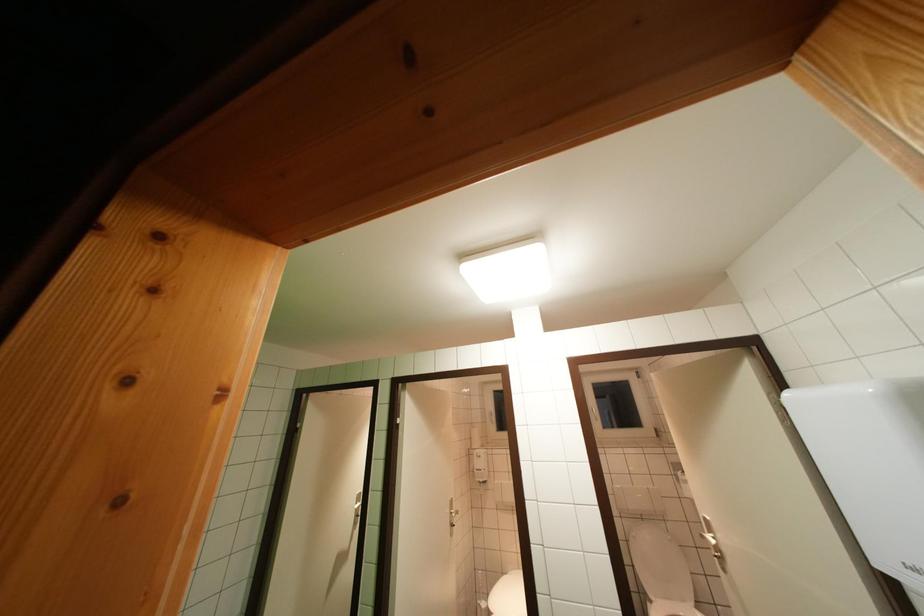
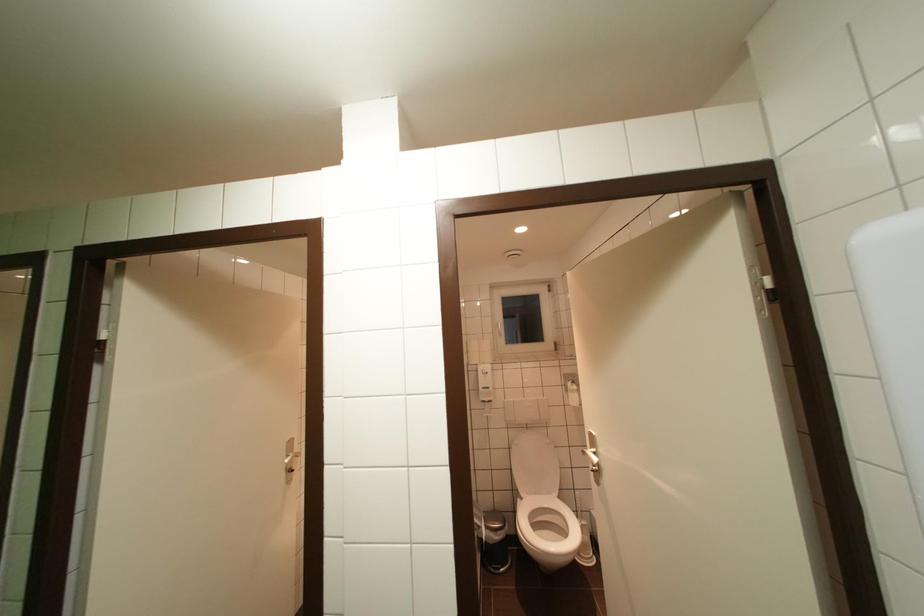
Where in the second image is the point corresponding to point 709,540 from the first image?

(591, 456)